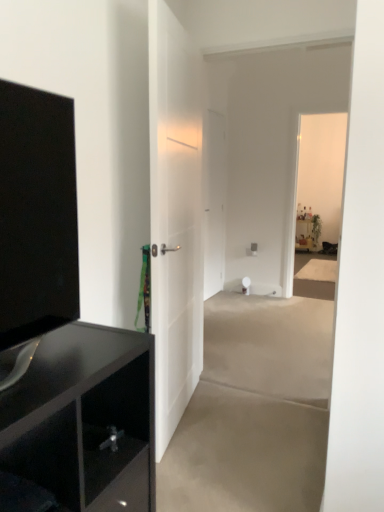
In order to click on free spot in front of white matte door at center, the 2th door when ordered from back to front in this screenshot , I will do `click(233, 480)`.